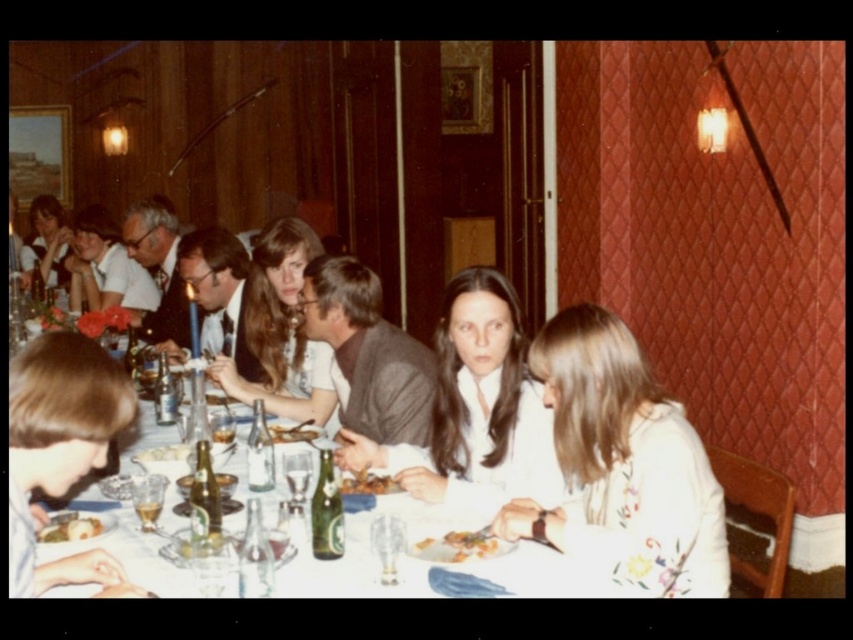
Between light blue shirt at lower left and golden brown bread at center, which one appears on the left side from the viewer's perspective?

From the viewer's perspective, light blue shirt at lower left appears more on the left side.

Can you confirm if light blue shirt at lower left is wider than golden brown bread at center?

Yes.

Locate an element on the screen. This screenshot has height=640, width=853. light blue shirt at lower left is located at coordinates (61, 451).

Does point (270, 394) lie behind point (285, 442)?

Yes, it is.

Between point (238, 381) and point (273, 438), which one is positioned behind?

The point (238, 381) is more distant.

Between point (259, 289) and point (296, 429), which one is positioned behind?

Point (259, 289)

What are the coordinates of `matte white shirt at center` in the screenshot? It's located at (277, 332).

How much distance is there between white matte shirt at center and golden crispy bread at center?

white matte shirt at center and golden crispy bread at center are 12.51 inches apart from each other.

Which of these two, white matte shirt at center or golden crispy bread at center, stands shorter?

Standing shorter between the two is golden crispy bread at center.

Does point (569, 385) lie in front of point (422, 550)?

No.

Locate an element on the screen. The width and height of the screenshot is (853, 640). white matte shirt at center is located at coordinates (614, 467).